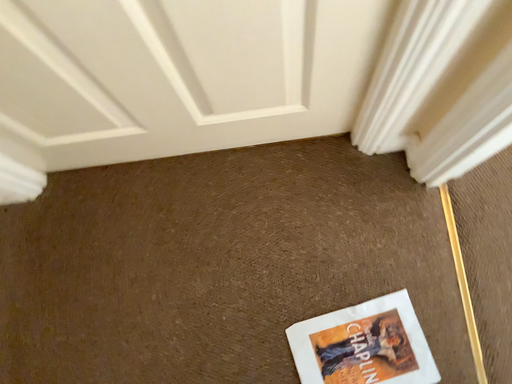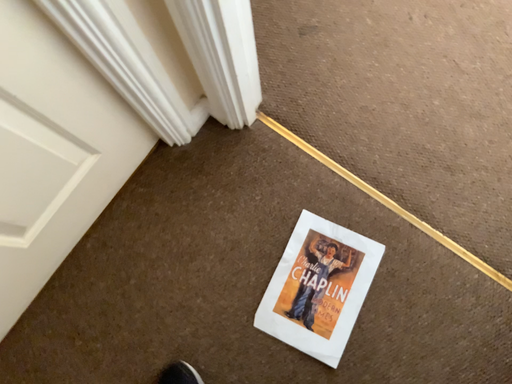
Question: How did the camera likely rotate when shooting the video?

Choices:
 (A) rotated upward
 (B) rotated downward

Answer: (A)